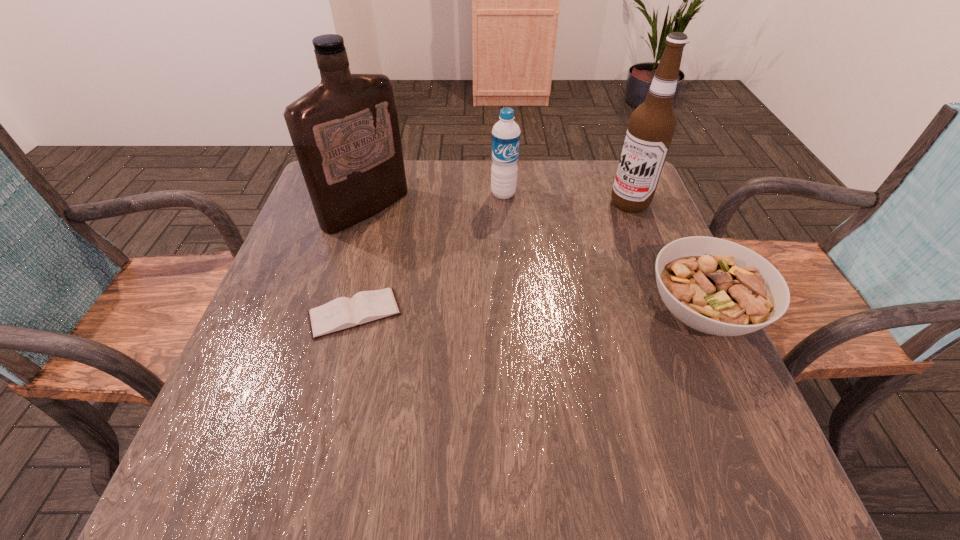
You are a GUI agent. You are given a task and a screenshot of the screen. Output one action in this format:
    pyautogui.click(x=<x>, y=<y>)
    Task: Click on the free spot on the desktop that is between the shortest object and the stew and is positioned on the label of the third shortest object
    Image resolution: width=960 pixels, height=540 pixels.
    Given the screenshot: What is the action you would take?
    pyautogui.click(x=515, y=313)

Where is `free space on the desktop that is between the diary and the stew and is positioned on the label side of the liquor`? This screenshot has width=960, height=540. free space on the desktop that is between the diary and the stew and is positioned on the label side of the liquor is located at coordinates (512, 313).

Find the location of a particular element. This screenshot has height=540, width=960. vacant spot on the desktop that is between the shortest object and the fourth tallest object and is positioned on the label of the alcohol is located at coordinates (499, 313).